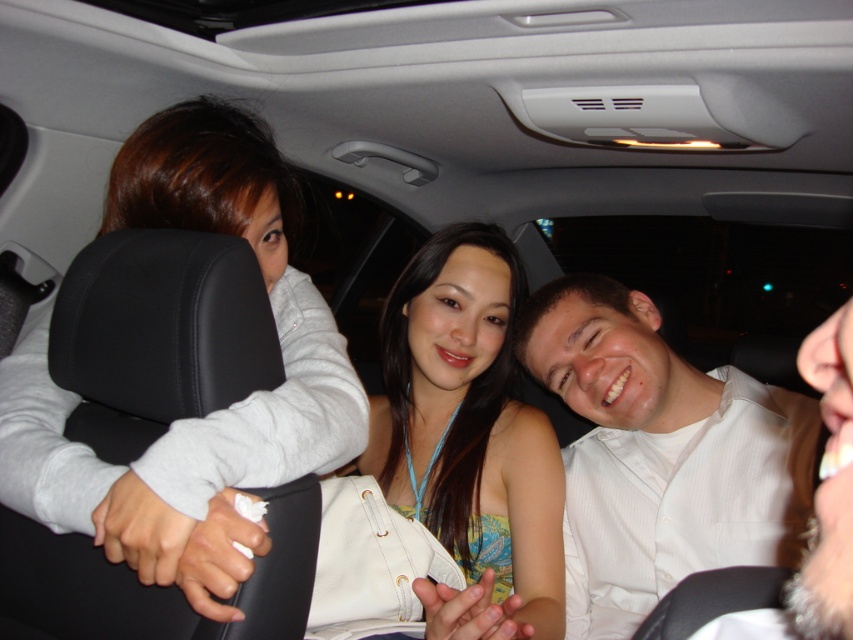
Question: Estimate the real-world distances between objects in this image. Which object is closer to the matte yellow tank top at center?

Choices:
 (A) white textured shirt at center
 (B) matte gray headrest at left

Answer: (A)

Question: Which of the following is the farthest from the observer?

Choices:
 (A) coord(444,540)
 (B) coord(762,387)

Answer: (A)

Question: Does white textured shirt at center appear under matte yellow tank top at center?

Choices:
 (A) no
 (B) yes

Answer: (A)

Question: Which point is farther to the camera?

Choices:
 (A) white textured shirt at center
 (B) matte gray headrest at left

Answer: (A)

Question: From the image, what is the correct spatial relationship of matte gray headrest at left in relation to white textured shirt at center?

Choices:
 (A) below
 (B) above

Answer: (B)

Question: Is matte gray headrest at left below matte yellow tank top at center?

Choices:
 (A) no
 (B) yes

Answer: (A)